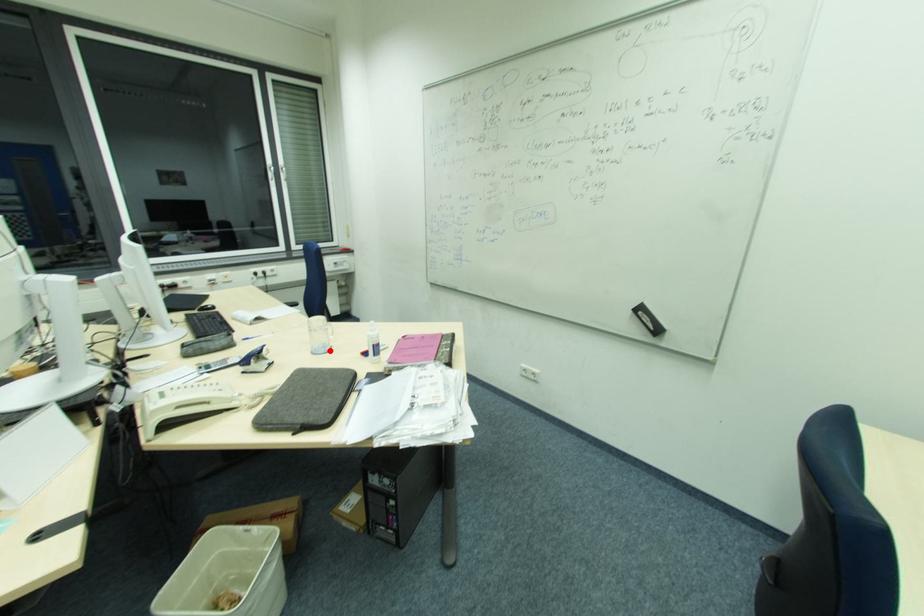
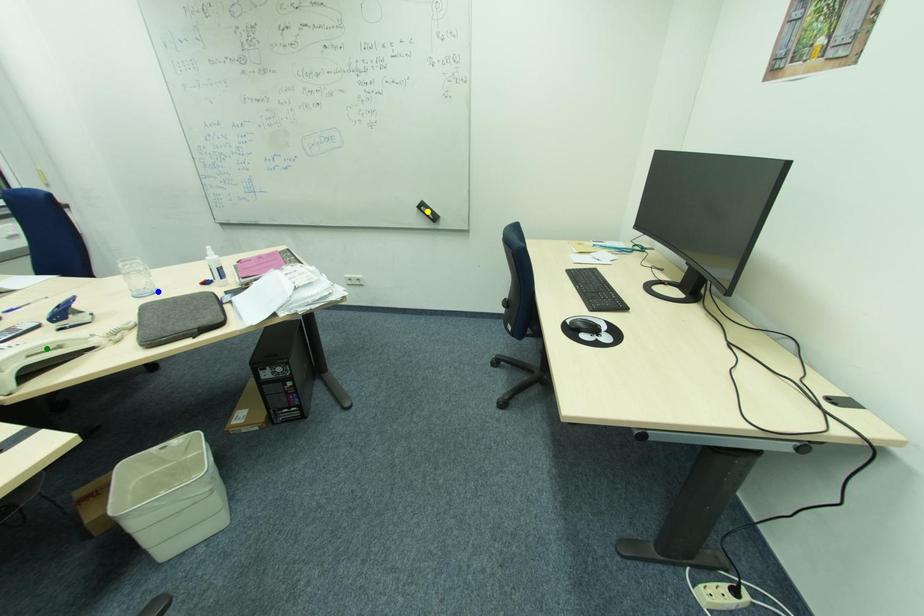
Question: I am providing you with two images of the same scene from different viewpoints. A red point is marked on the first image. You are given multiple points on the second image. Which point in image 2 represents the same 3d spot as the red point in image 1?

Choices:
 (A) green point
 (B) blue point
 (C) yellow point

Answer: (B)